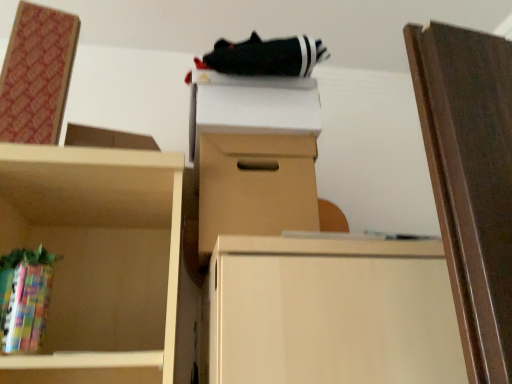
Describe the element at coordinates (255, 185) in the screenshot. I see `brown cardboard drawer at center` at that location.

Where is `brown cardboard drawer at center`? brown cardboard drawer at center is located at coordinates (255, 185).

What is the approximate width of brown cardboard drawer at center?

The width of brown cardboard drawer at center is 14.59 inches.

In order to click on brown cardboard drawer at center in this screenshot , I will do `click(255, 185)`.